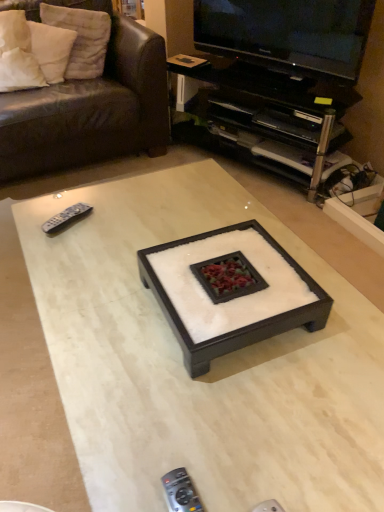
Where is `vacant space situated above white marble coffee table at center, positioned as the 2th coffee table in top-to-bottom order (from a real-world perspective)`? The width and height of the screenshot is (384, 512). vacant space situated above white marble coffee table at center, positioned as the 2th coffee table in top-to-bottom order (from a real-world perspective) is located at coordinates (152, 309).